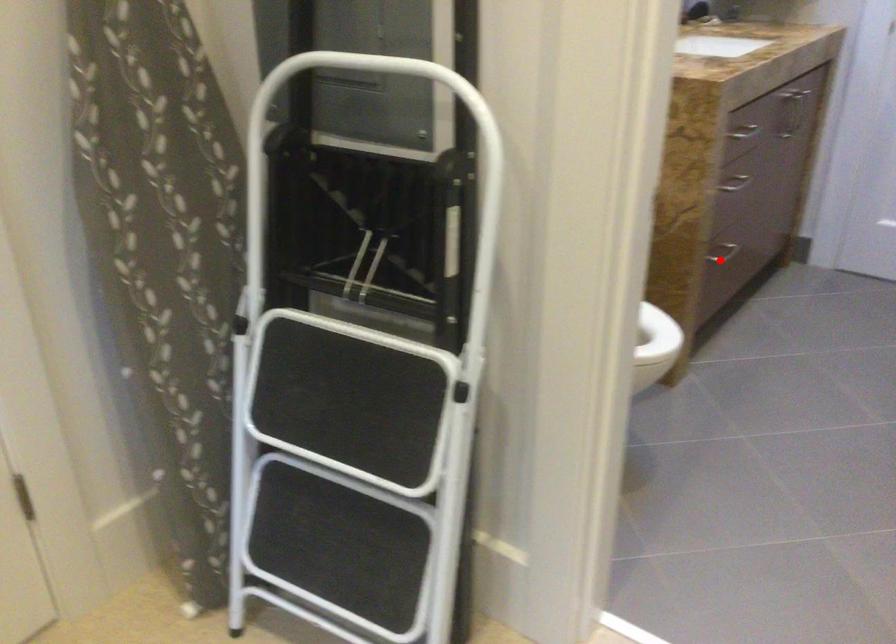
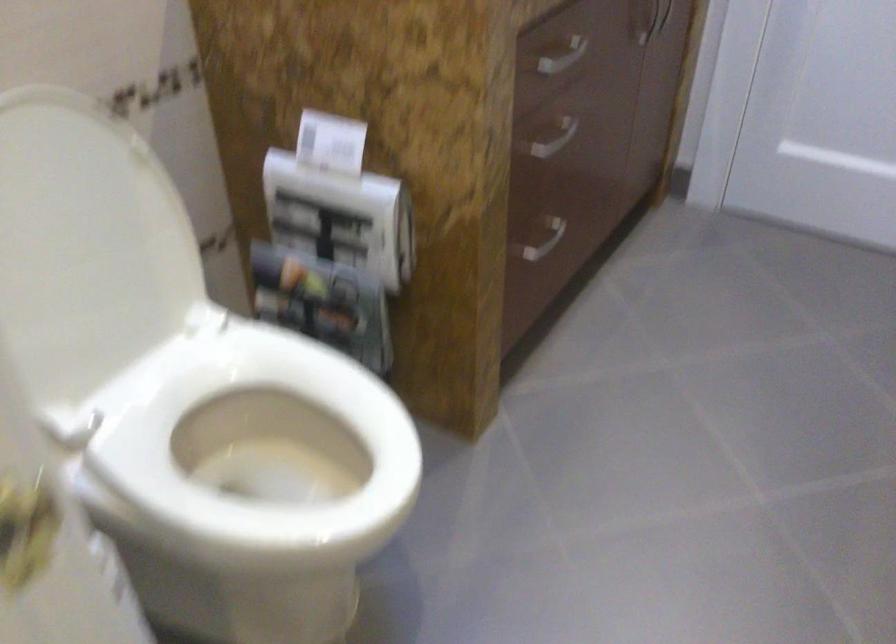
In the second image, find the point that corresponds to the highlighted location in the first image.

(538, 238)